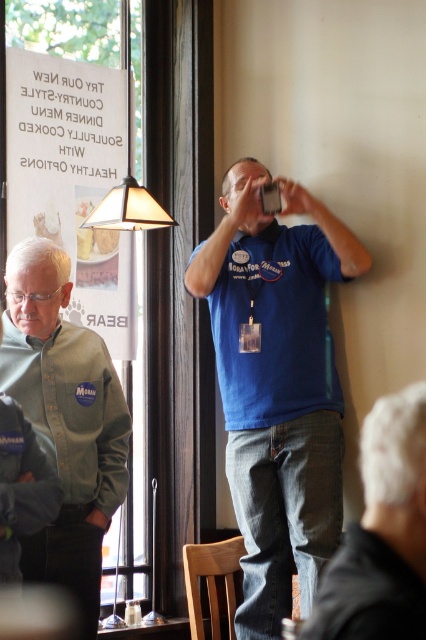
Question: Does green button-down shirt at left have a larger size compared to translucent glass lampshade at upper left?

Choices:
 (A) no
 (B) yes

Answer: (B)

Question: Among these objects, which one is farthest from the camera?

Choices:
 (A) white paper sign at upper left
 (B) blue denim jeans at lower center

Answer: (A)

Question: Which object is positioned closest to the blue denim jeans at lower center?

Choices:
 (A) white paper sign at upper left
 (B) green button-down shirt at left
 (C) blue cotton shirt at center
 (D) translucent glass lampshade at upper left

Answer: (B)

Question: Among these objects, which one is farthest from the camera?

Choices:
 (A) translucent glass lampshade at upper left
 (B) white paper sign at upper left
 (C) blue cotton shirt at center

Answer: (B)

Question: Can you confirm if blue denim jeans at lower center is bigger than translucent glass lampshade at upper left?

Choices:
 (A) no
 (B) yes

Answer: (B)

Question: Does green button-down shirt at left appear under blue denim jeans at lower center?

Choices:
 (A) no
 (B) yes

Answer: (A)